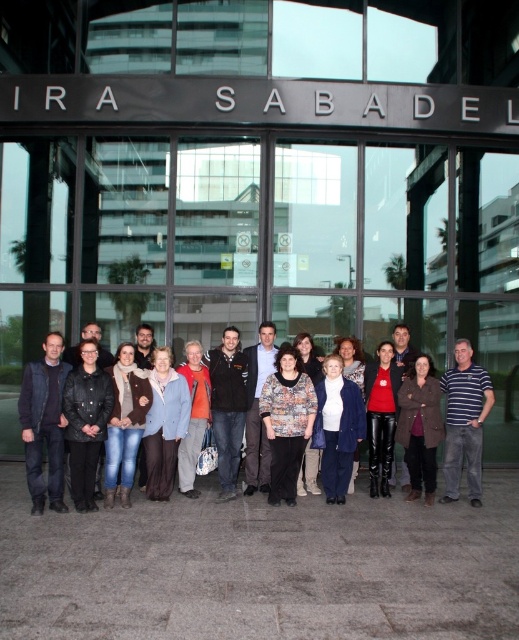
You are a photographer taking a group photo of the denim jacket at center and orange fabric sweater at center. Which clothing item will appear larger in the final photo?

The denim jacket at center will appear larger in the final photo because it is bigger than the orange fabric sweater at center.

You are standing in front of the modern building with the group of people. You want to take a photo of the denim jacket at center without any people in front of it. Is the distance sufficient to capture the entire jacket in your camera frame?

The denim jacket at center is 22.62 feet away from the viewer. Since this distance is relatively far, it may be challenging to capture the entire jacket in the camera frame without including any people in front of it. Consider moving closer or using a zoom lens to focus on the jacket.

You are a photographer trying to capture a group photo of the denim jacket at center and the light blue fabric coat at center. Which clothing item should you focus on first if you want to ensure both are in frame without zooming in? Explain your reasoning based on their sizes.

The denim jacket at center is wider than the light blue fabric coat at center. To ensure both are in frame without zooming in, focus on the denim jacket at center first since it requires more space due to its larger width.